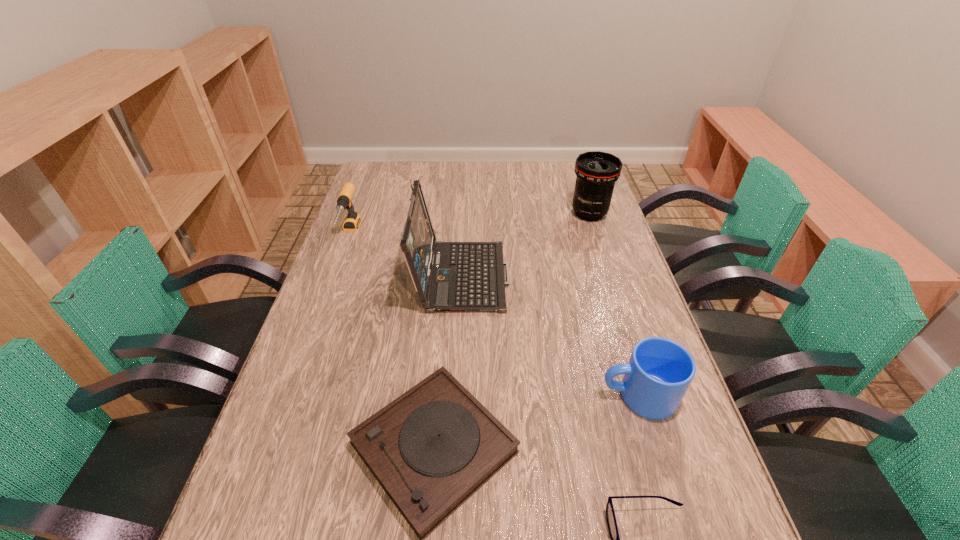
Where is `object that is at the left edge`? The height and width of the screenshot is (540, 960). object that is at the left edge is located at coordinates (352, 221).

Image resolution: width=960 pixels, height=540 pixels. I want to click on telephoto lens present at the right edge, so click(x=596, y=171).

Where is `mug located at the right edge`? The height and width of the screenshot is (540, 960). mug located at the right edge is located at coordinates (659, 372).

At what (x,y) coordinates should I click in order to perform the action: click on free space at the far edge. Please return your answer as a coordinate pair (x, y). This screenshot has width=960, height=540. Looking at the image, I should click on (513, 169).

The width and height of the screenshot is (960, 540). Find the location of `vacant area at the left edge`. vacant area at the left edge is located at coordinates (287, 390).

In the image, there is a desktop. Where is `vacant area at the right edge`? vacant area at the right edge is located at coordinates [567, 199].

Where is `vacant space that is in between the mug and the telephoto lens`? The image size is (960, 540). vacant space that is in between the mug and the telephoto lens is located at coordinates (613, 305).

Where is `free space between the mug and the drill`? This screenshot has height=540, width=960. free space between the mug and the drill is located at coordinates click(x=493, y=315).

You are a GUI agent. You are given a task and a screenshot of the screen. Output one action in this format:
    pyautogui.click(x=<x>, y=<y>)
    Task: Click on the vacant space that is in between the drill and the mug
    The height and width of the screenshot is (540, 960).
    Given the screenshot: What is the action you would take?
    pyautogui.click(x=493, y=315)

Identify which object is the nearest to the drill. Please provide its 2D coordinates. Your answer should be formatted as a tuple, i.e. [(x, y)], where the tuple contains the x and y coordinates of a point satisfying the conditions above.

[(449, 276)]